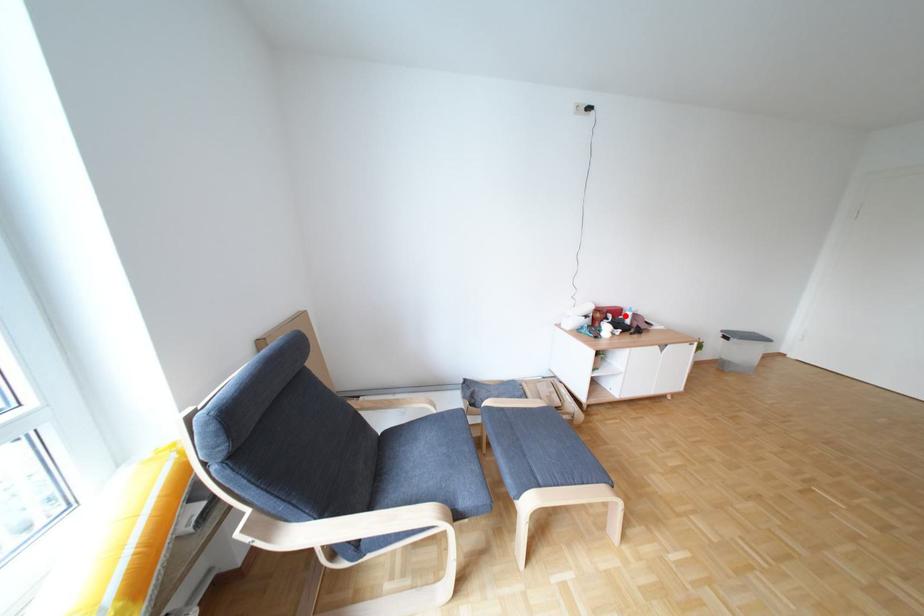
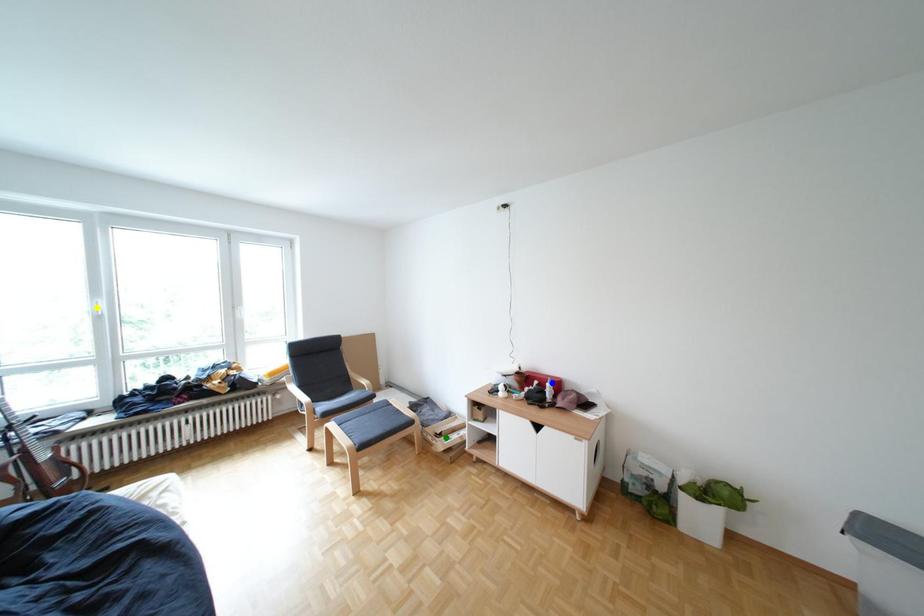
Question: I am providing you with two images of the same scene from different viewpoints. A red point is marked on the first image. You are given multiple points on the second image. In image 2, which mark is for the same physical point as the one in image 1?

Choices:
 (A) yellow point
 (B) green point
 (C) blue point

Answer: (C)